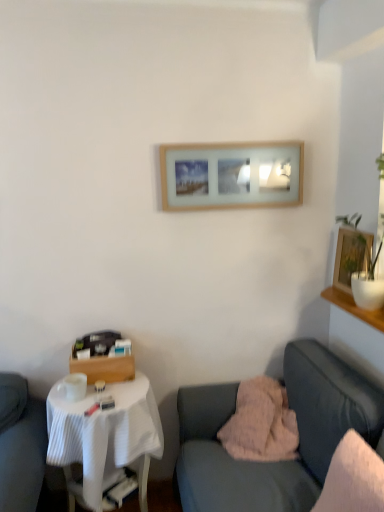
Where is `free spot above wooden picture frame at upper center, which ranks as the 2th picture frame in bottom-to-top order (from a real-world perspective)`? Image resolution: width=384 pixels, height=512 pixels. free spot above wooden picture frame at upper center, which ranks as the 2th picture frame in bottom-to-top order (from a real-world perspective) is located at coordinates (236, 138).